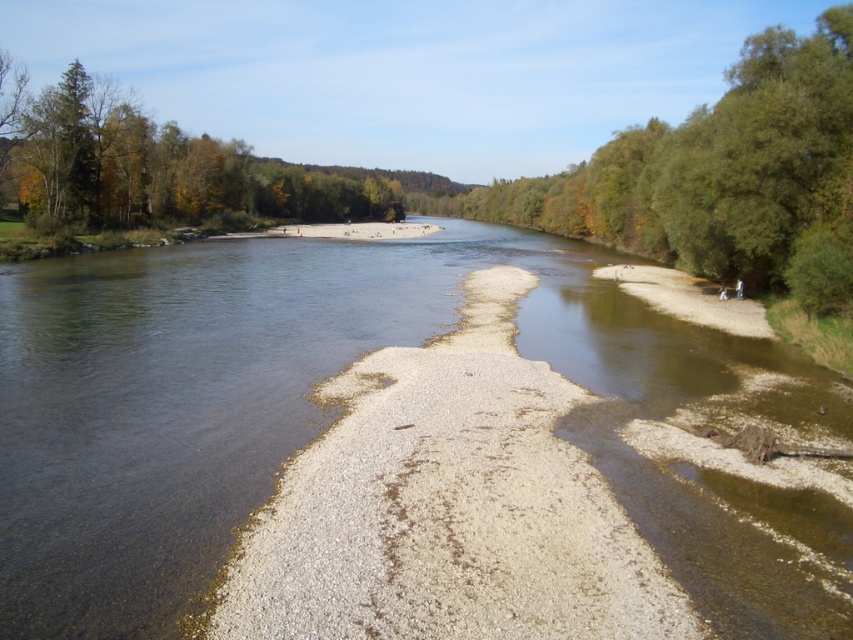
Does clear water at center have a larger size compared to green leafy tree at upper left?

No.

Is clear water at center wider than green leafy tree at upper left?

Incorrect, clear water at center's width does not surpass green leafy tree at upper left's.

Between point (50, 413) and point (200, 141), which one is positioned behind?

The point (200, 141) is more distant.

Locate an element on the screen. Image resolution: width=853 pixels, height=640 pixels. clear water at center is located at coordinates (334, 416).

Is clear water at center thinner than green leafy tree at right?

No, clear water at center is not thinner than green leafy tree at right.

Can you confirm if clear water at center is bigger than green leafy tree at right?

No, clear water at center is not bigger than green leafy tree at right.

Which is in front, point (670, 317) or point (695, 248)?

Point (670, 317) is in front.

At what (x,y) coordinates should I click in order to perform the action: click on clear water at center. Please return your answer as a coordinate pair (x, y). The width and height of the screenshot is (853, 640). Looking at the image, I should click on 334,416.

Is green leafy tree at right positioned in front of green leafy tree at upper left?

Yes, green leafy tree at right is closer to the viewer.

Who is more distant from viewer, (x=808, y=288) or (x=254, y=168)?

Point (x=254, y=168)

Between point (668, 250) and point (184, 212), which one is positioned in front?

Positioned in front is point (668, 250).

Identify the location of green leafy tree at right. (724, 177).